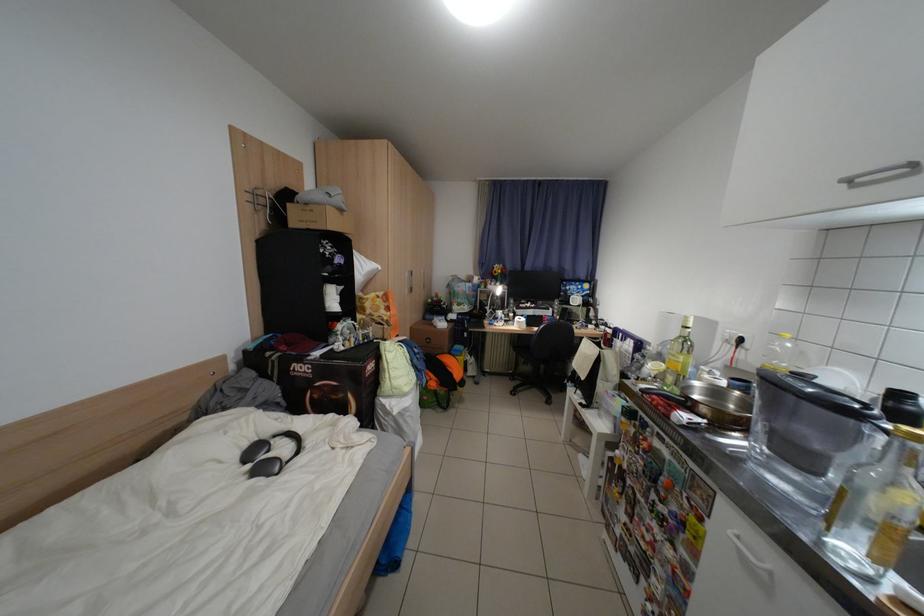
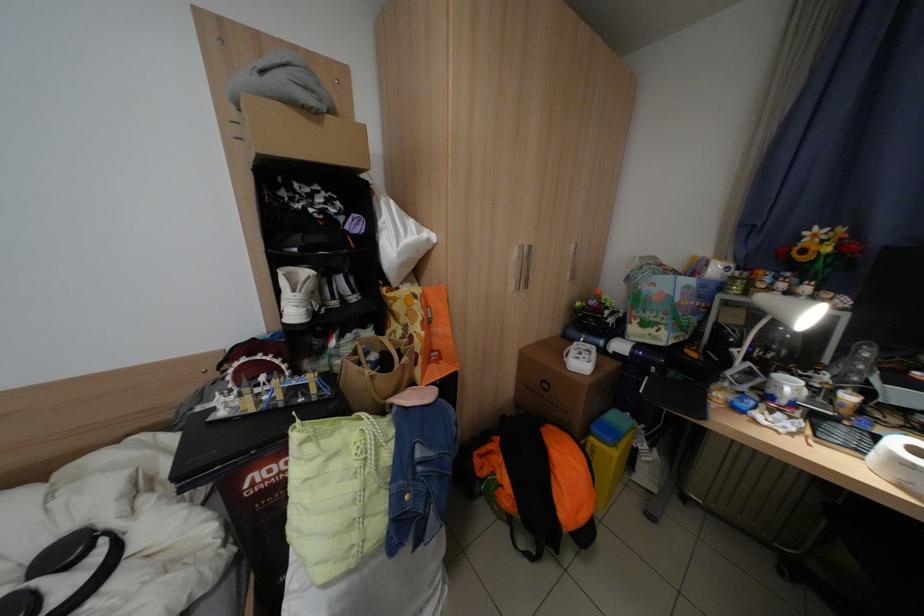
Where in the second image is the point corresponding to the point at 464,353 from the first image?

(604, 430)